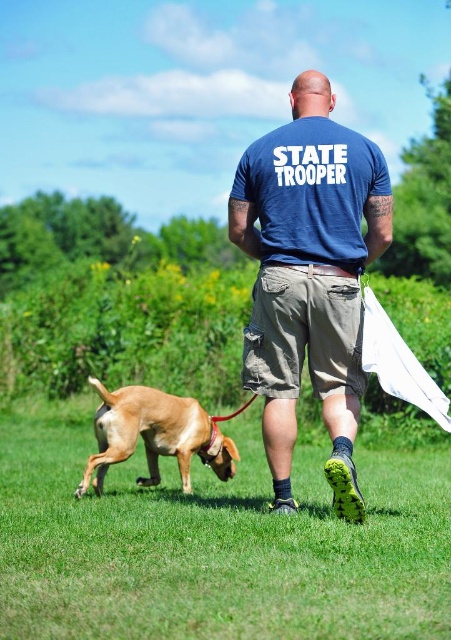
Can you confirm if khaki cotton shorts at center is shorter than golden brown fur at lower left?

Yes, khaki cotton shorts at center is shorter than golden brown fur at lower left.

Can you confirm if khaki cotton shorts at center is bigger than golden brown fur at lower left?

Incorrect, khaki cotton shorts at center is not larger than golden brown fur at lower left.

I want to click on khaki cotton shorts at center, so click(x=303, y=333).

Is green grass at lower center further to the viewer compared to blue cotton shirt at center?

No, green grass at lower center is in front of blue cotton shirt at center.

Does green grass at lower center appear over blue cotton shirt at center?

Actually, green grass at lower center is below blue cotton shirt at center.

The image size is (451, 640). In order to click on green grass at lower center in this screenshot , I will do pos(216,544).

Between blue cotton shirt at center and golden brown fur at lower left, which one appears on the left side from the viewer's perspective?

From the viewer's perspective, golden brown fur at lower left appears more on the left side.

Between blue cotton shirt at center and golden brown fur at lower left, which one is positioned higher?

blue cotton shirt at center is above.

Where is `blue cotton shirt at center`? The image size is (451, 640). blue cotton shirt at center is located at coordinates click(x=309, y=276).

This screenshot has height=640, width=451. Identify the location of blue cotton shirt at center. (309, 276).